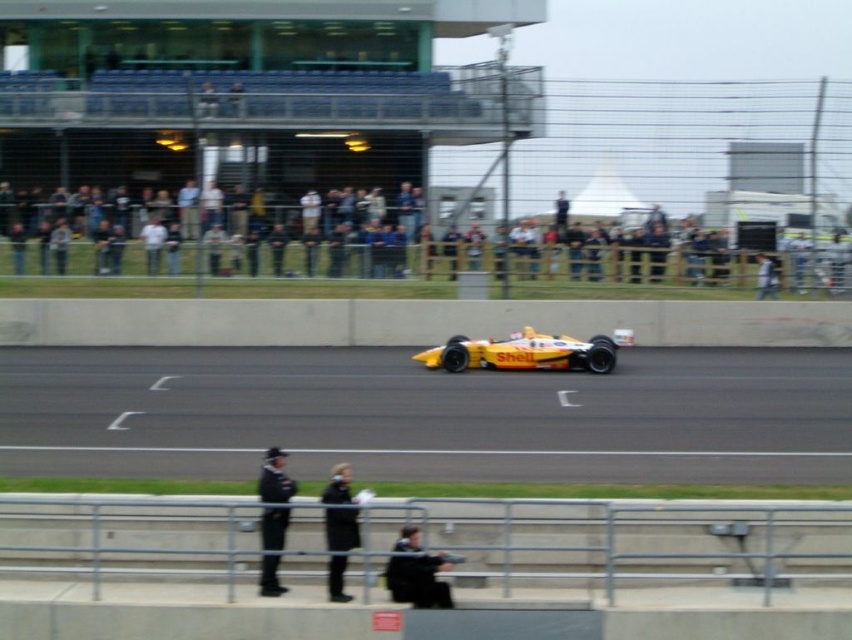
Question: Among these objects, which one is farthest from the camera?

Choices:
 (A) yellow matte race car at center
 (B) black leather jacket at center

Answer: (A)

Question: Does yellow rubber race track at center lie behind dark gray suit at center?

Choices:
 (A) no
 (B) yes

Answer: (B)

Question: Which object is positioned farthest from the uniformed officer at center?

Choices:
 (A) yellow rubber race track at center
 (B) yellow matte race car at center
 (C) dark gray suit at center

Answer: (B)

Question: Which object appears farthest from the camera in this image?

Choices:
 (A) dark gray suit at center
 (B) black leather jacket at center

Answer: (B)

Question: Is yellow matte race car at center positioned before uniformed officer at center?

Choices:
 (A) no
 (B) yes

Answer: (A)

Question: Considering the relative positions of yellow-orange racing car at center and yellow matte race car at center in the image provided, where is yellow-orange racing car at center located with respect to yellow matte race car at center?

Choices:
 (A) left
 (B) right

Answer: (A)